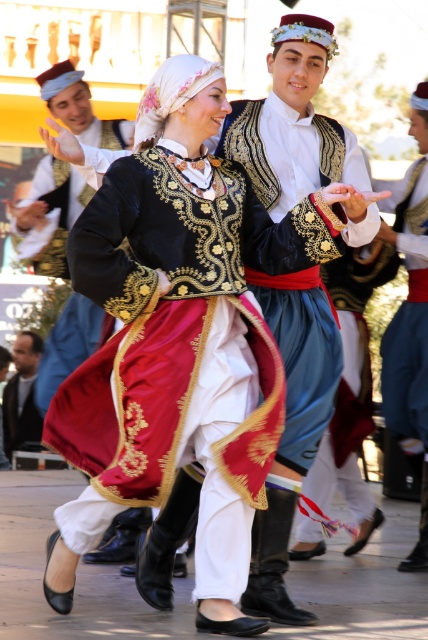
What is the point at coordinate (180, 339) located on?

The point at coordinate (180, 339) is located on the velvet red skirt at center.

You are a photographer trying to capture the dancers in the center of the image. You notice two points marked in the scene. Which point, point 1 at coordinates (291, 500) or point 2 at (68, 195), is closer to your camera lens?

Point 1 at coordinates (291, 500) is closer to the camera lens than point 2 at (68, 195).

Looking at this image, you are an artist trying to sketch the scene. You need to place the velvet red skirt at center in your drawing. Where should you position it on a canvas divided into a grid from 0 to 1 on both axes?

The velvet red skirt at center should be positioned at the coordinates point (180, 339) on the canvas grid.